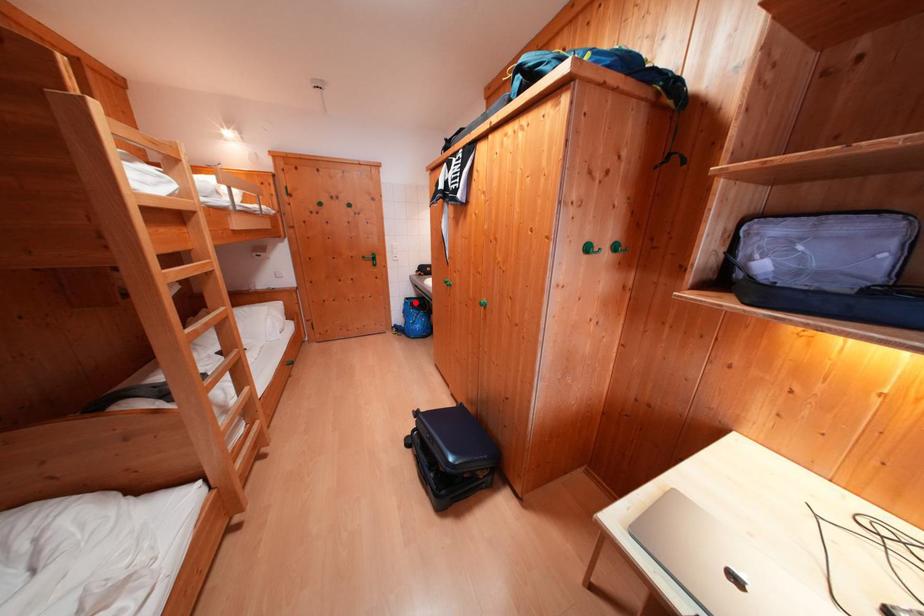
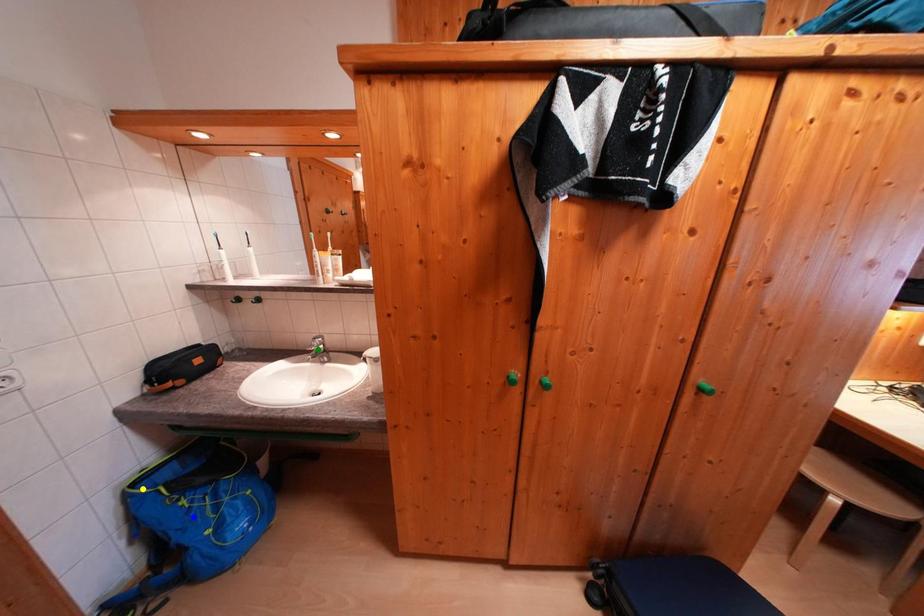
Question: I am providing you with two images of the same scene from different viewpoints. A red point is marked on the first image. You are given multiple points on the second image. Which point in image 2 represents the same 3d spot as the red point in image 1?

Choices:
 (A) yellow point
 (B) green point
 (C) blue point

Answer: (A)